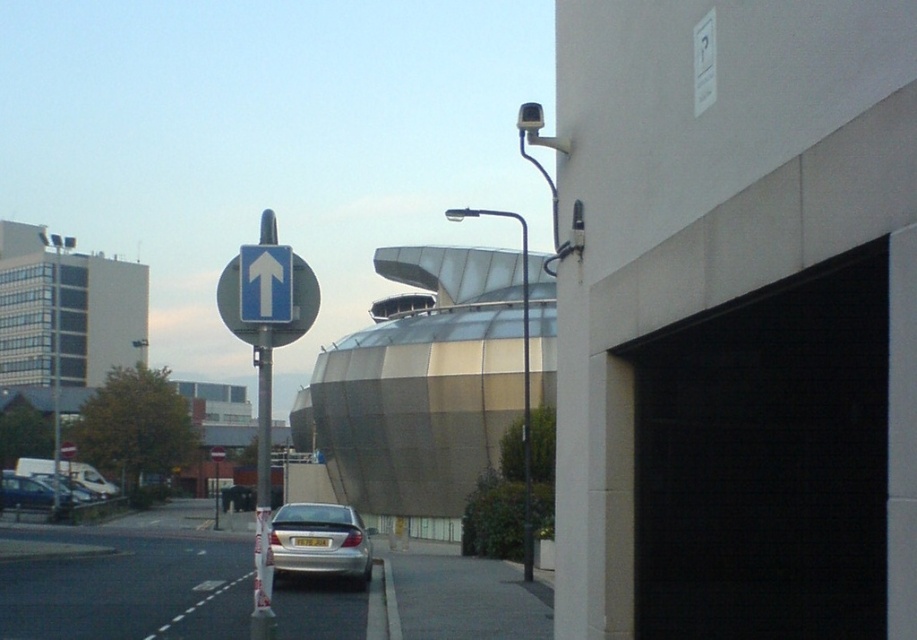
You are a delivery driver who needs to determine the best path to navigate through the scene. Considering the smooth asphalt road at lower left and the blue glossy sign at upper left, which one takes up more visual space in the image?

The blue glossy sign at upper left takes up more visual space than the smooth asphalt road at lower left.

You are a pedestrian standing at the intersection and see the blue glossy arrow at upper center and the metallic silver car at lower left. Which object is higher in the image?

The blue glossy arrow at upper center is higher in the image than the metallic silver car at lower left.